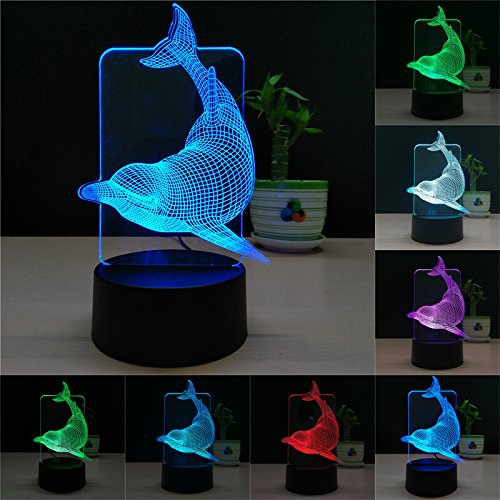
Find the location of `wood surface`. wood surface is located at coordinates (318, 359).